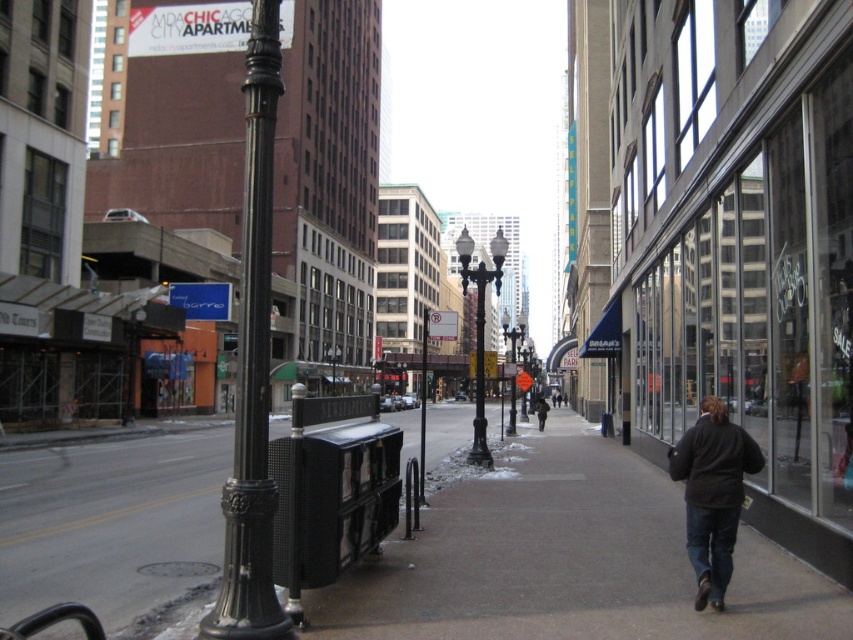
Question: Which point is farther from the camera taking this photo?

Choices:
 (A) (538, 422)
 (B) (505, 426)
 (C) (525, 410)
 (D) (697, 424)

Answer: (C)

Question: Can you confirm if black polished metal streetlight at center is positioned above polished bronze streetlight at center?

Choices:
 (A) no
 (B) yes

Answer: (B)

Question: Does black metal streetlight at center appear over brown fuzzy coat at center?

Choices:
 (A) no
 (B) yes

Answer: (B)

Question: Which point is closer to the camera taking this photo?

Choices:
 (A) (254, 220)
 (B) (508, 417)
 (C) (540, 416)
 (D) (502, 522)

Answer: (A)

Question: Which point is farther from the camera taking this photo?

Choices:
 (A) (521, 337)
 (B) (741, 532)
 (C) (525, 412)

Answer: (C)

Question: Is black cast iron pole at left to the right of black metal streetlight at center from the viewer's perspective?

Choices:
 (A) yes
 (B) no

Answer: (B)